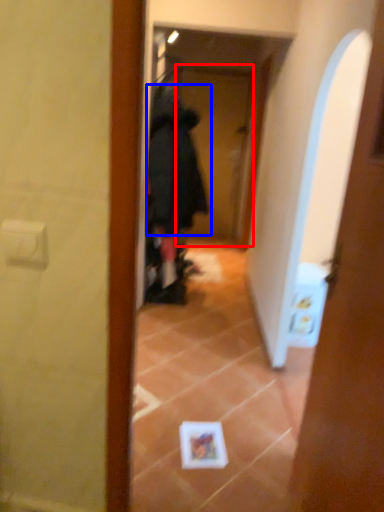
Question: Which object is closer to the camera taking this photo, screen door (highlighted by a red box) or bathrobe (highlighted by a blue box)?

Choices:
 (A) screen door
 (B) bathrobe

Answer: (B)